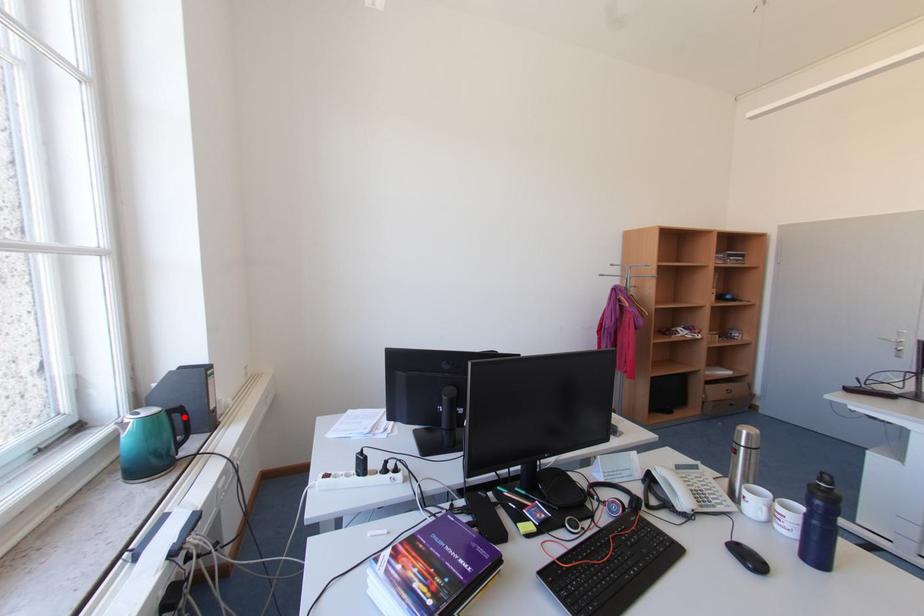
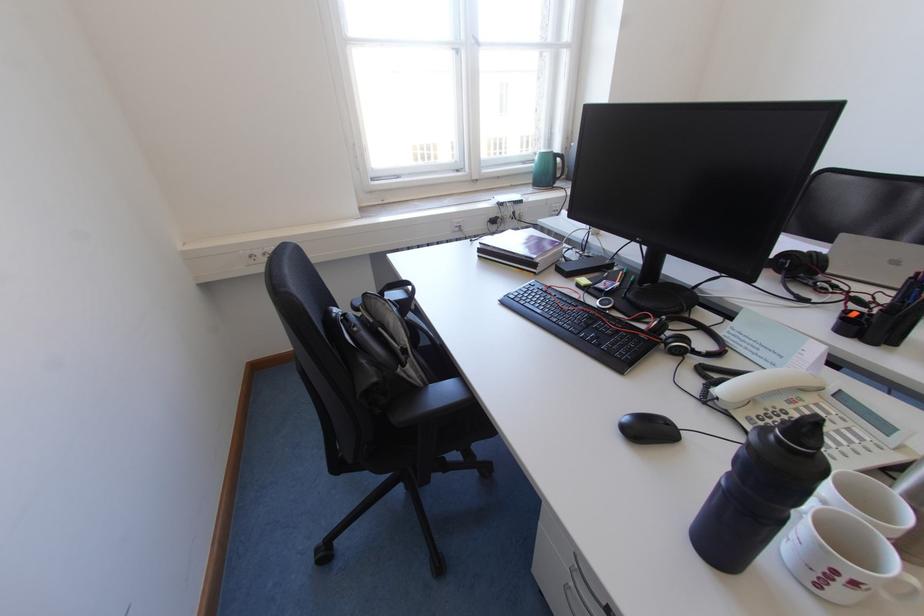
Find the pixel in the second image that matches the highlighted location in the first image.

(566, 161)